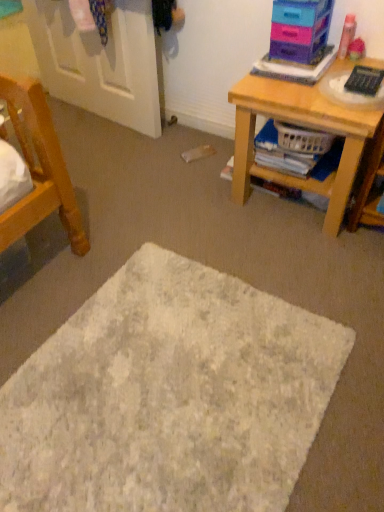
The image size is (384, 512). What are the coordinates of `free spot behind black plastic remote control at upper right` in the screenshot? It's located at (347, 65).